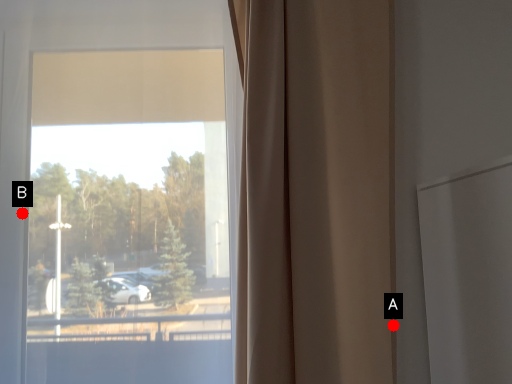
Question: Two points are circled on the image, labeled by A and B beside each circle. Which of the following is the closest to the observer?

Choices:
 (A) A is closer
 (B) B is closer

Answer: (A)